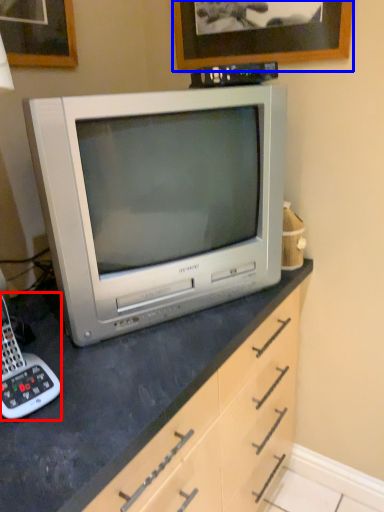
Question: Which object is further to the camera taking this photo, corded phone (highlighted by a red box) or picture frame (highlighted by a blue box)?

Choices:
 (A) corded phone
 (B) picture frame

Answer: (B)